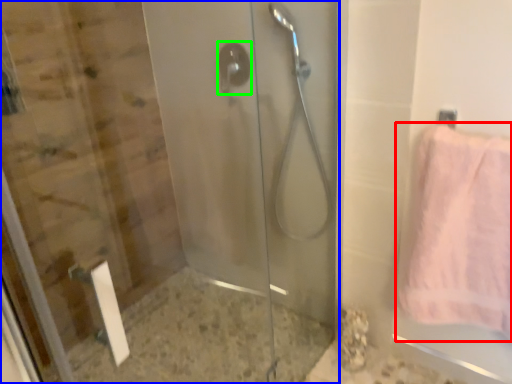
Question: Which object is positioned closest to towel (highlighted by a red box)? Select from screen door (highlighted by a blue box) and shower (highlighted by a green box).

Choices:
 (A) screen door
 (B) shower

Answer: (A)